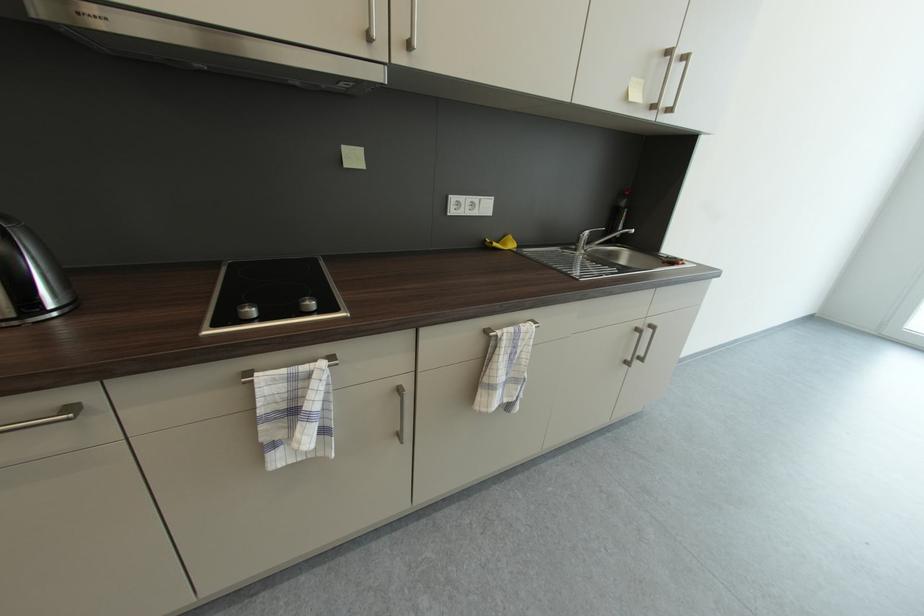
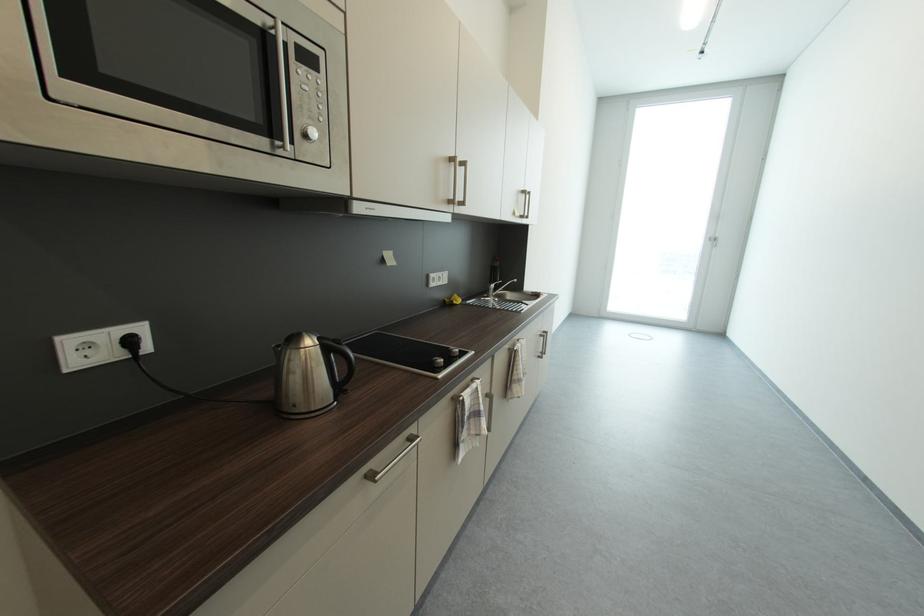
Where in the second image is the point corresponding to point (265, 413) from the first image?

(472, 419)